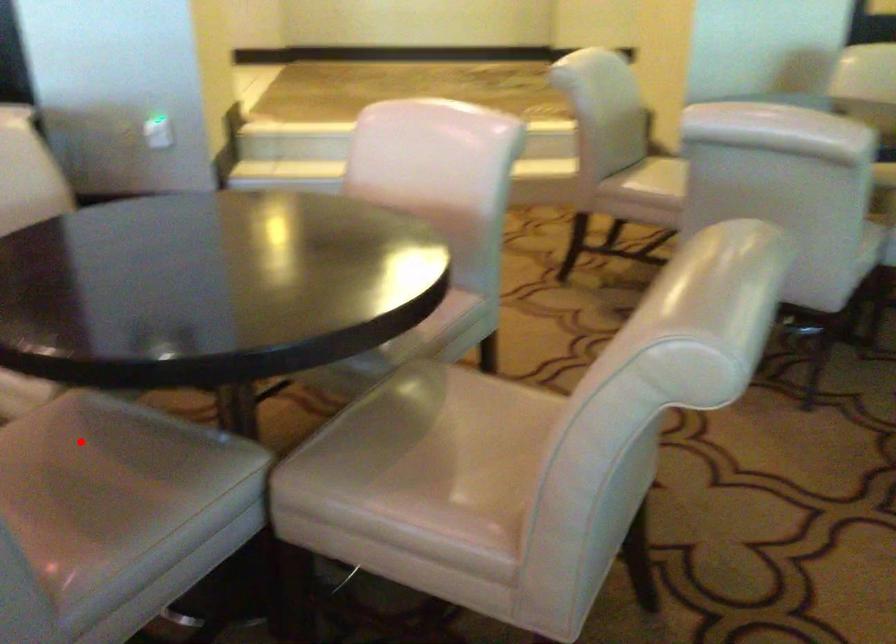
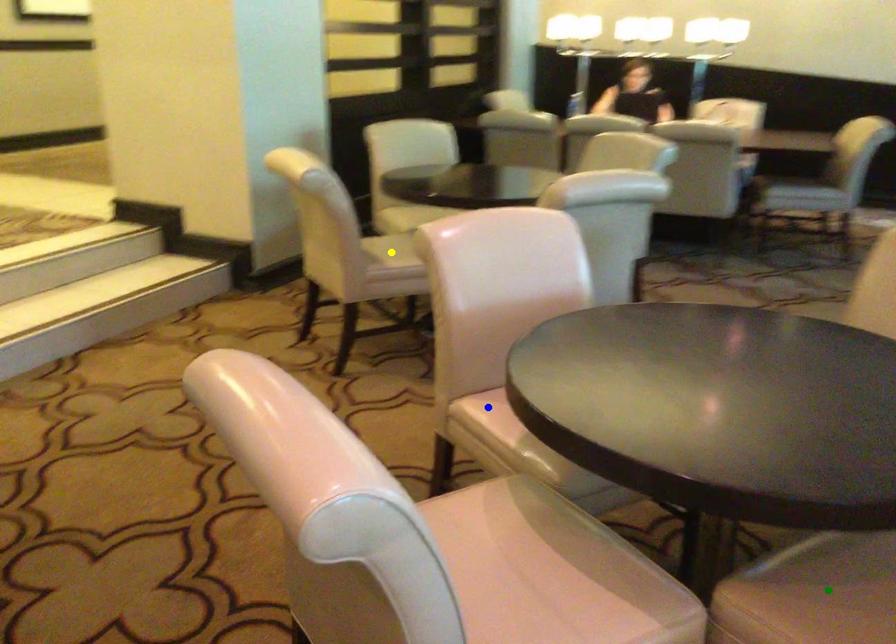
Question: I am providing you with two images of the same scene from different viewpoints. A red point is marked on the first image. You are given multiple points on the second image. In image 2, which mark is for the same physical point as the one in image 1?

Choices:
 (A) green point
 (B) yellow point
 (C) blue point

Answer: (A)